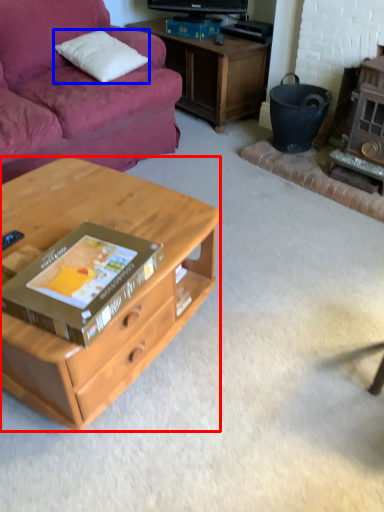
Question: Which of the following is the farthest to the observer, desk (highlighted by a red box) or pillow (highlighted by a blue box)?

Choices:
 (A) desk
 (B) pillow

Answer: (B)